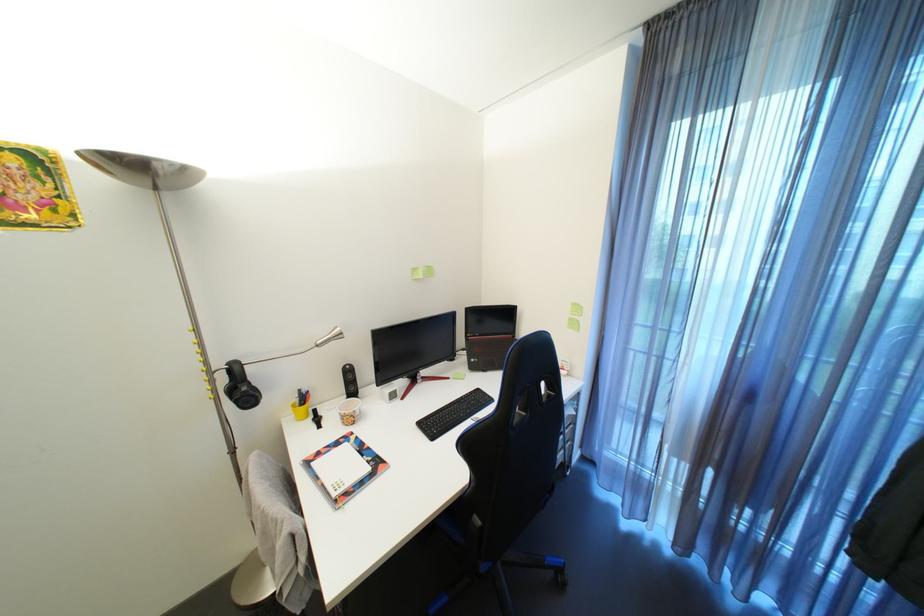
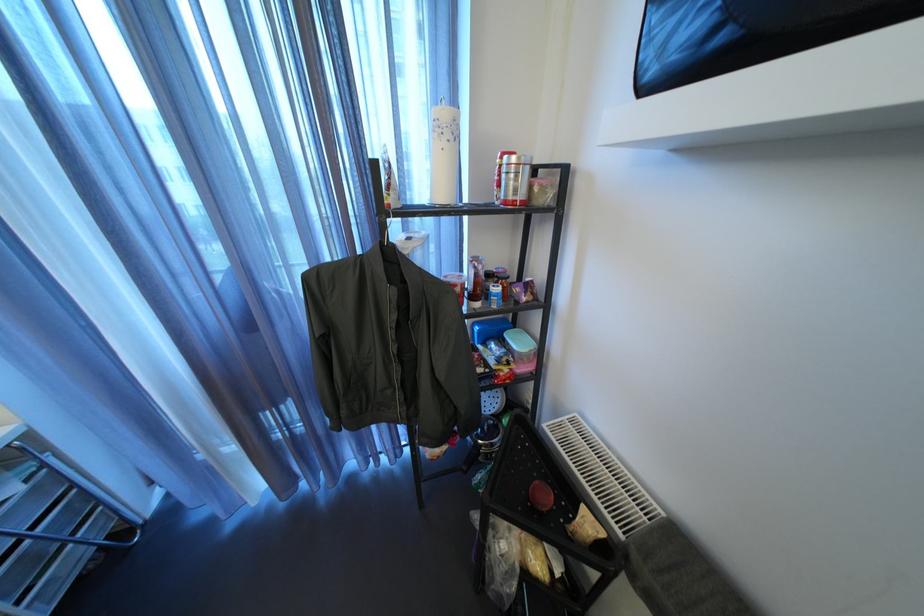
Based on the continuous images, in which direction is the camera rotating?

The rotation direction of the camera is right-down.